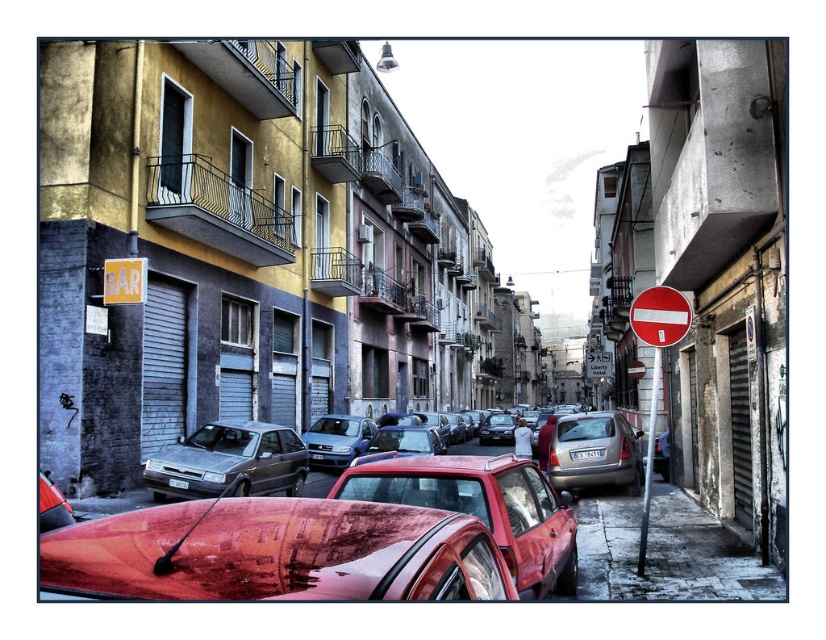
Question: Is smooth concrete sidewalk at lower right smaller than silver metallic hatchback at center?

Choices:
 (A) yes
 (B) no

Answer: (A)

Question: Which object appears farthest from the camera in this image?

Choices:
 (A) metallic gray sedan at center-left
 (B) red plastic sign at center
 (C) white plastic license plate at center

Answer: (B)

Question: Is red plastic sign at center positioned behind white plastic license plate at center?

Choices:
 (A) no
 (B) yes

Answer: (B)

Question: Considering the real-world distances, which object is closest to the red plastic sign at right?

Choices:
 (A) red plastic sign at center
 (B) silver metallic hatchback at center

Answer: (B)

Question: Which is nearer to the metallic gray sedan at center-left?

Choices:
 (A) rusty metallic car at center
 (B) red glossy stop sign at right

Answer: (B)

Question: Can you confirm if red plastic sign at right is bigger than white plastic license plate at center?

Choices:
 (A) yes
 (B) no

Answer: (A)